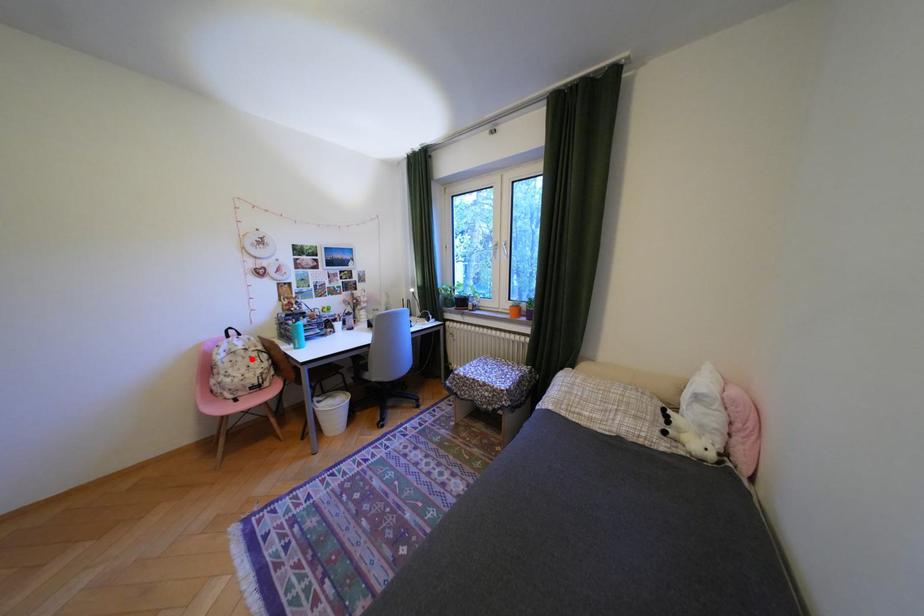
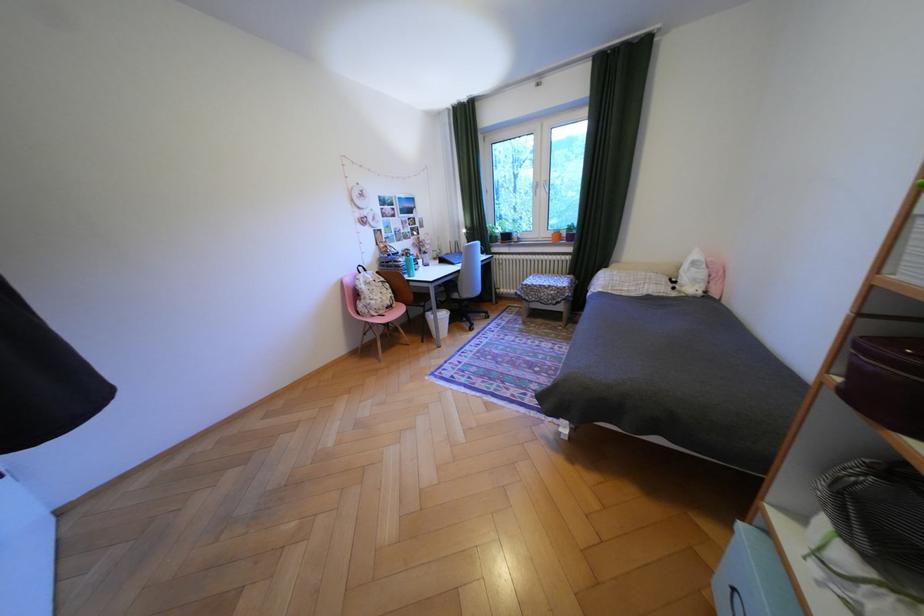
Question: I am providing you with two images of the same scene from different viewpoints. A red point is marked on the first image. Can you still see the location of the red point in image 2?

Choices:
 (A) Yes
 (B) No

Answer: (A)